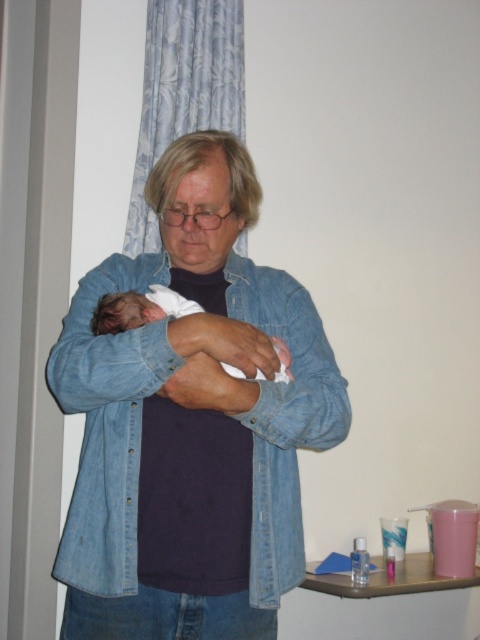
Can you confirm if faded denim jacket at center is positioned to the right of white soft newborn at center?

Yes, faded denim jacket at center is to the right of white soft newborn at center.

Does faded denim jacket at center appear under white soft newborn at center?

Indeed, faded denim jacket at center is positioned under white soft newborn at center.

What do you see at coordinates (108, 424) in the screenshot? This screenshot has height=640, width=480. I see `faded denim jacket at center` at bounding box center [108, 424].

At what (x,y) coordinates should I click in order to perform the action: click on faded denim jacket at center. Please return your answer as a coordinate pair (x, y). Looking at the image, I should click on 108,424.